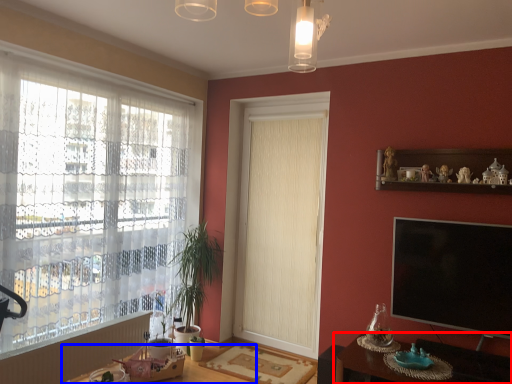
Question: Which object is closer to the camera taking this photo, table (highlighted by a red box) or round table (highlighted by a blue box)?

Choices:
 (A) table
 (B) round table

Answer: (A)